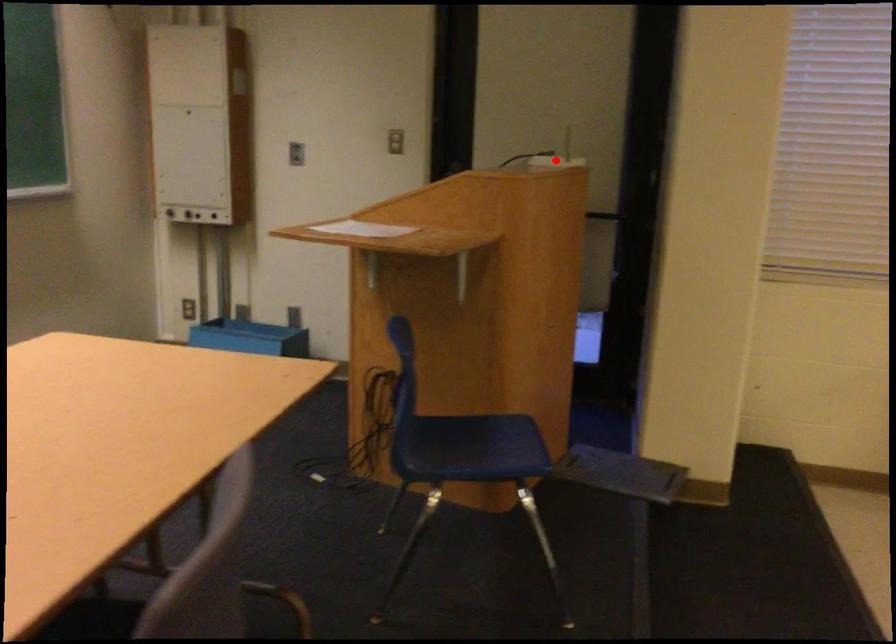
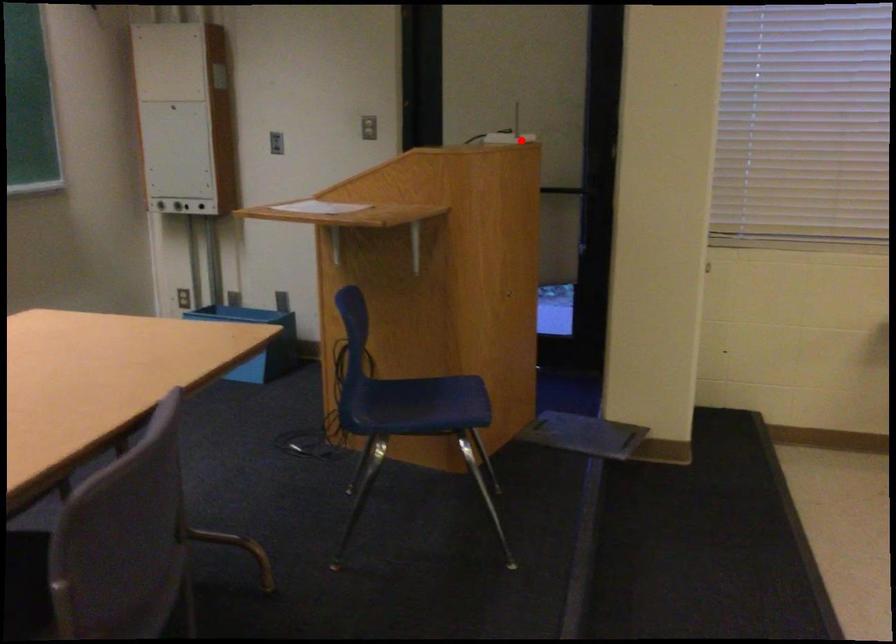
I am providing you with two images of the same scene from different viewpoints. A red point is marked on the first image and another point is marked on the second image. Do the highlighted points in image1 and image2 indicate the same real-world spot?

Yes